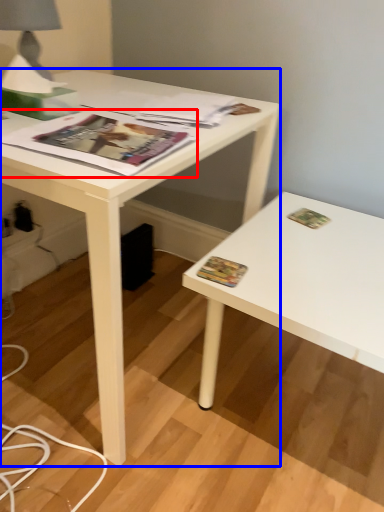
Question: Which object is closer to the camera taking this photo, magazine (highlighted by a red box) or desk (highlighted by a blue box)?

Choices:
 (A) magazine
 (B) desk

Answer: (B)